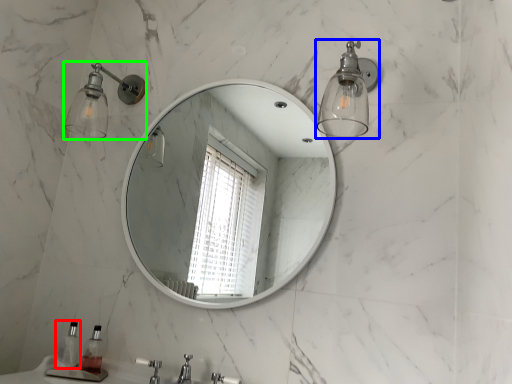
Question: Based on their relative distances, which object is nearer to soap dispenser (highlighted by a red box)? Choose from light fixture (highlighted by a blue box) and shower (highlighted by a green box).

Choices:
 (A) light fixture
 (B) shower

Answer: (B)